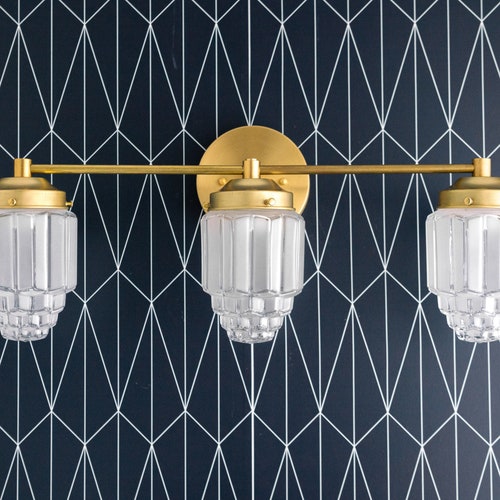
Where is `wall`? This screenshot has width=500, height=500. wall is located at coordinates (203, 437).